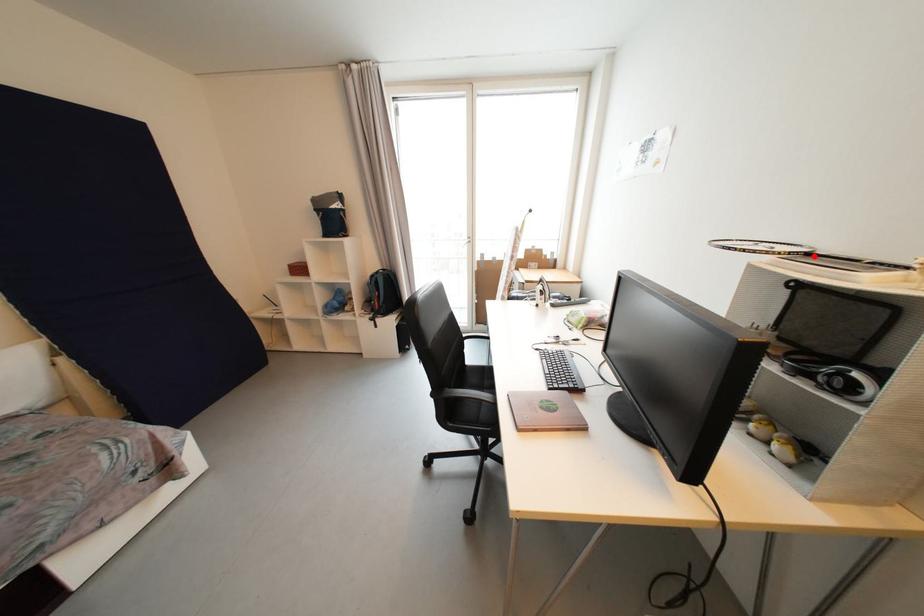
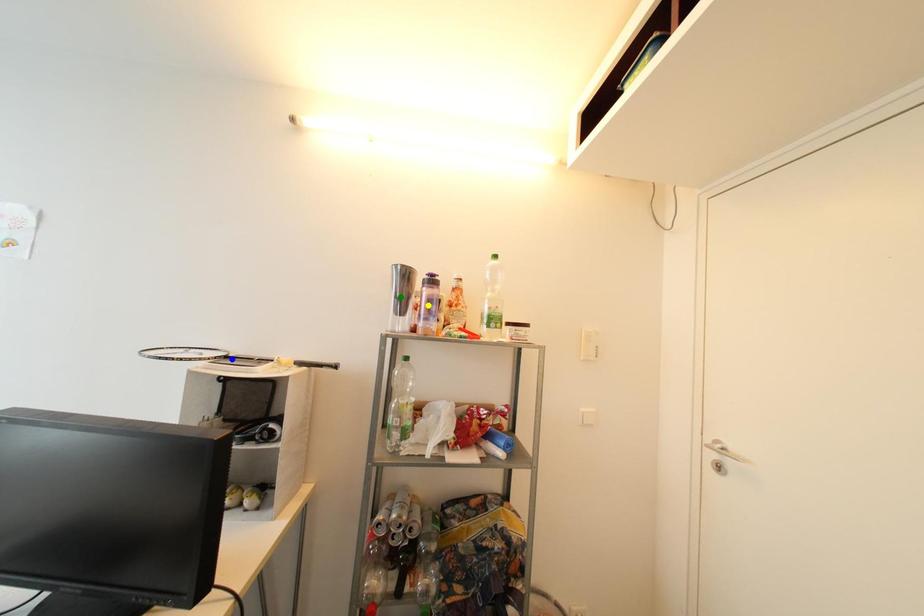
Question: I am providing you with two images of the same scene from different viewpoints. A red point is marked on the first image. You are given multiple points on the second image. In image 2, which mark is for the same physical point as the one in image 1?

Choices:
 (A) blue point
 (B) green point
 (C) yellow point

Answer: (A)